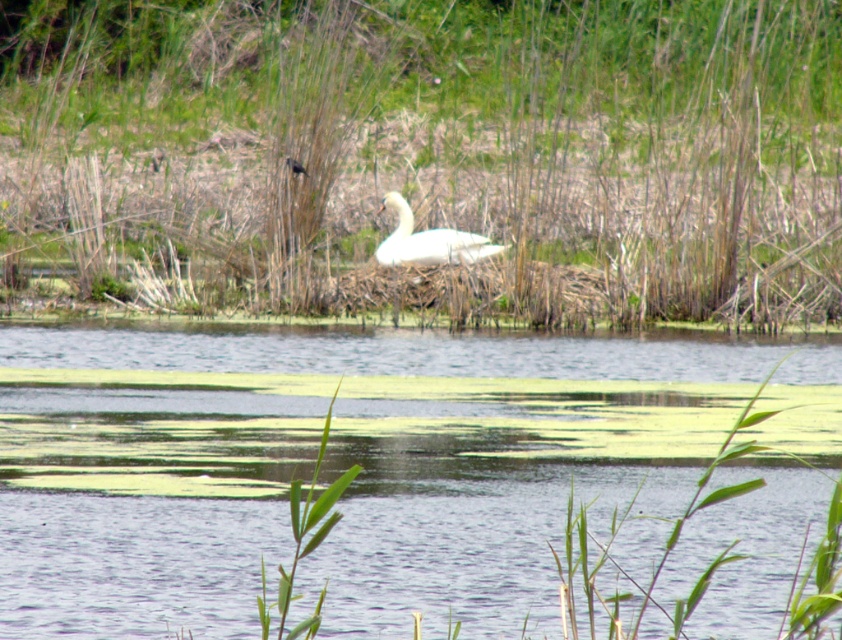
Can you confirm if green grass at center is taller than silvery metallic bird at center?

Correct, green grass at center is much taller as silvery metallic bird at center.

Who is positioned more to the left, green grass at center or silvery metallic bird at center?

Positioned to the left is silvery metallic bird at center.

Who is more forward, [750,294] or [294,163]?

Point [750,294] is in front.

The width and height of the screenshot is (842, 640). In order to click on green grass at center in this screenshot , I will do `click(430, 154)`.

Can you confirm if clear water at center is positioned to the left of silvery metallic bird at center?

No, clear water at center is not to the left of silvery metallic bird at center.

Does point (276, 484) lie in front of point (300, 164)?

Yes.

The width and height of the screenshot is (842, 640). In order to click on clear water at center in this screenshot , I will do `click(342, 467)`.

Is green grass at center closer to camera compared to white glossy swan at center?

That is True.

Does point (24, 266) lie in front of point (401, 253)?

No, (24, 266) is behind (401, 253).

Locate an element on the screen. The image size is (842, 640). green grass at center is located at coordinates (430, 154).